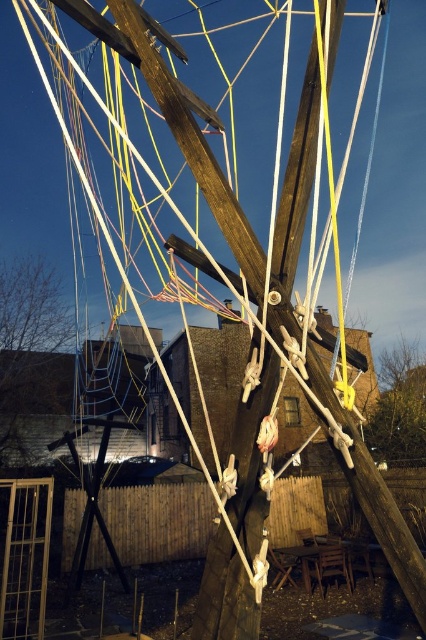
Is green matte tree at lower left positioned behind wooden swing at right?

Yes, green matte tree at lower left is behind wooden swing at right.

Who is positioned more to the right, green matte tree at lower left or wooden swing at right?

wooden swing at right

You are a GUI agent. You are given a task and a screenshot of the screen. Output one action in this format:
    pyautogui.click(x=<x>, y=<y>)
    Task: Click on the green matte tree at lower left
    
    Given the screenshot: What is the action you would take?
    pyautogui.click(x=31, y=348)

The width and height of the screenshot is (426, 640). I want to click on green matte tree at lower left, so click(31, 348).